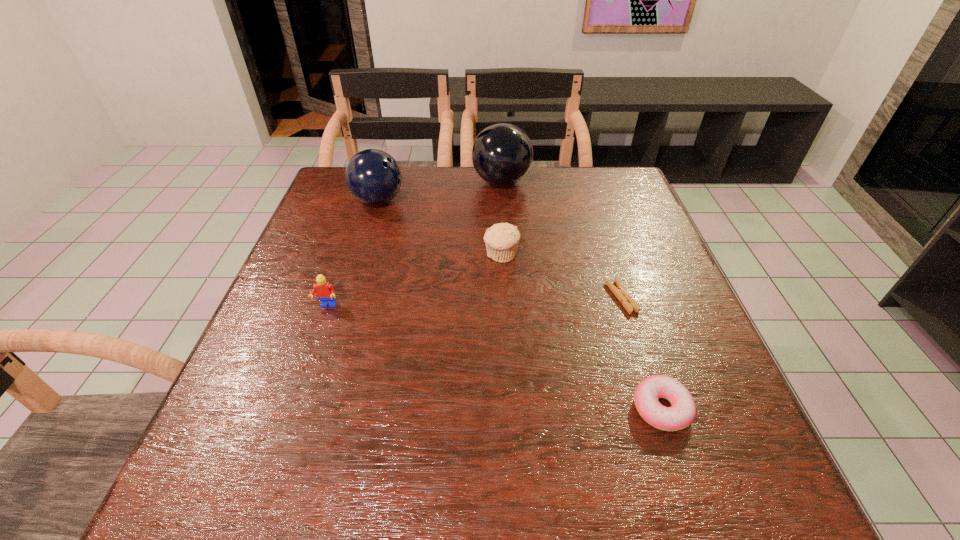
The width and height of the screenshot is (960, 540). What are the coordinates of `object present at the far left corner` in the screenshot? It's located at (372, 176).

I want to click on free region at the far edge of the desktop, so click(426, 184).

The image size is (960, 540). I want to click on vacant space at the near edge, so click(626, 494).

You are a GUI agent. You are given a task and a screenshot of the screen. Output one action in this format:
    pyautogui.click(x=<x>, y=<y>)
    Task: Click on the vacant space at the left edge of the desktop
    
    Given the screenshot: What is the action you would take?
    pyautogui.click(x=306, y=421)

The width and height of the screenshot is (960, 540). In order to click on vacant space at the right edge of the desktop in this screenshot , I will do `click(657, 233)`.

Identify the location of vacant space at the far right corner of the desktop. (617, 209).

The image size is (960, 540). I want to click on blank region between the muffin and the right bowling ball, so click(x=501, y=218).

Find the location of a particular element. The width and height of the screenshot is (960, 540). empty space between the fourth nearest object and the fifth shortest object is located at coordinates (440, 228).

At what (x,y) coordinates should I click in order to perform the action: click on vacant region between the shortest object and the muffin. Please return your answer as a coordinate pair (x, y). This screenshot has width=960, height=540. Looking at the image, I should click on (562, 276).

Find the location of `vacant region between the right bowling ball and the second tallest object`. vacant region between the right bowling ball and the second tallest object is located at coordinates (440, 192).